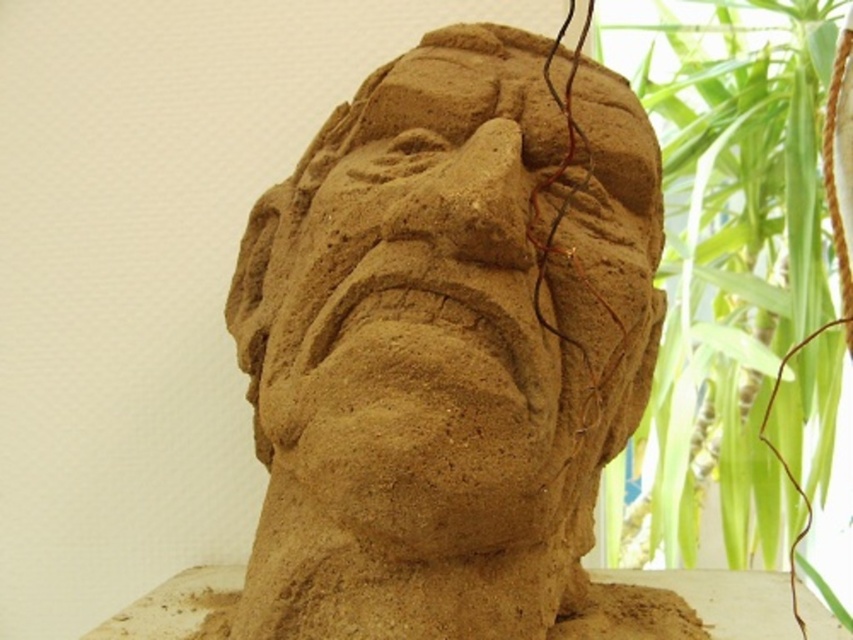
You are a photographer wanting to capture the brown sand sculpture at center and the green leafy plant at upper right in a single frame. Based on their positions, which object should you focus on first to ensure both are in the frame without moving the camera?

The brown sand sculpture at center is below the green leafy plant at upper right, so you should focus on the green leafy plant at upper right first to ensure both are in the frame without moving the camera.

You are standing in front of the sand sculpture and want to take a photo of both the brown sand sculpture at center and the green leafy plant at upper right. Which object should you focus on first to ensure both are in clear view?

The brown sand sculpture at center is closer to the viewer than the green leafy plant at upper right. To ensure both are in clear view, focus on the brown sand sculpture at center first, as it is closer, and adjust the camera to include the green leafy plant at upper right in the background.